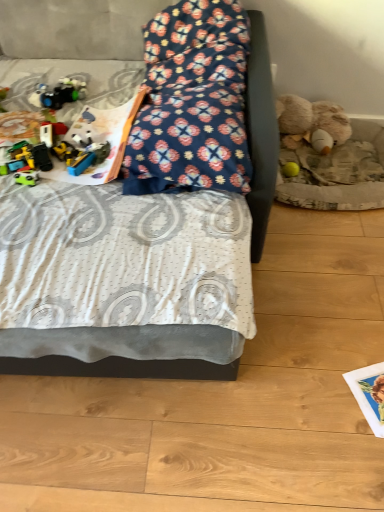
Question: Is yellow rubber ball at lower right, which is the second toy from bottom to top, not close to fluffy beige teddy bear at right?

Choices:
 (A) yes
 (B) no

Answer: (B)

Question: Can you confirm if yellow rubber ball at lower right, the third toy from the front, is wider than fluffy beige teddy bear at right?

Choices:
 (A) yes
 (B) no

Answer: (B)

Question: Is yellow rubber ball at lower right, which is the first toy from back to front, bigger than fluffy beige teddy bear at right?

Choices:
 (A) yes
 (B) no

Answer: (B)

Question: Is the depth of yellow rubber ball at lower right, the third toy from the front, less than that of fluffy beige teddy bear at right?

Choices:
 (A) no
 (B) yes

Answer: (A)

Question: From a real-world perspective, is yellow rubber ball at lower right, the third toy from the left, beneath fluffy beige teddy bear at right?

Choices:
 (A) no
 (B) yes

Answer: (B)

Question: From the image's perspective, would you say yellow rubber ball at lower right, the third toy from the front, is shown under fluffy beige teddy bear at right?

Choices:
 (A) yes
 (B) no

Answer: (A)

Question: Is the depth of floral fabric pillow at center less than that of shiny plastic toy car at left, which is the third toy in right-to-left order?

Choices:
 (A) no
 (B) yes

Answer: (B)

Question: Is floral fabric pillow at center to the right of shiny plastic toy car at left, marked as the second toy in a back-to-front arrangement, from the viewer's perspective?

Choices:
 (A) no
 (B) yes

Answer: (B)

Question: Is floral fabric pillow at center further to camera compared to shiny plastic toy car at left, marked as the second toy in a back-to-front arrangement?

Choices:
 (A) yes
 (B) no

Answer: (B)

Question: Is floral fabric pillow at center facing away from shiny plastic toy car at left, the 1th toy from the left?

Choices:
 (A) no
 (B) yes

Answer: (A)

Question: Does floral fabric pillow at center have a smaller size compared to shiny plastic toy car at left, marked as the 3th toy in a bottom-to-top arrangement?

Choices:
 (A) no
 (B) yes

Answer: (A)

Question: Is floral fabric pillow at center at the left side of shiny plastic toy car at left, which is the third toy in right-to-left order?

Choices:
 (A) no
 (B) yes

Answer: (A)

Question: Is floral fabric bed at center closer to the viewer compared to shiny plastic toy car at left, arranged as the 1th toy when viewed from the top?

Choices:
 (A) no
 (B) yes

Answer: (B)